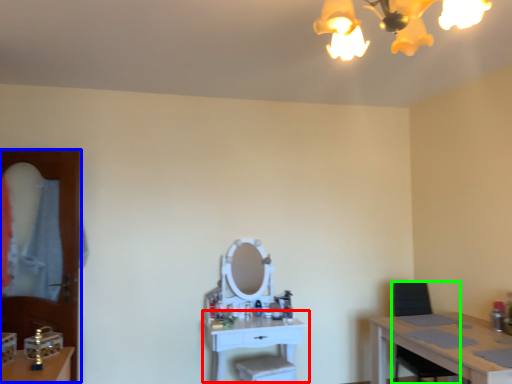
Question: Which object is positioned farthest from table (highlighted by a red box)? Select from glass door (highlighted by a blue box) and armchair (highlighted by a green box).

Choices:
 (A) glass door
 (B) armchair

Answer: (A)